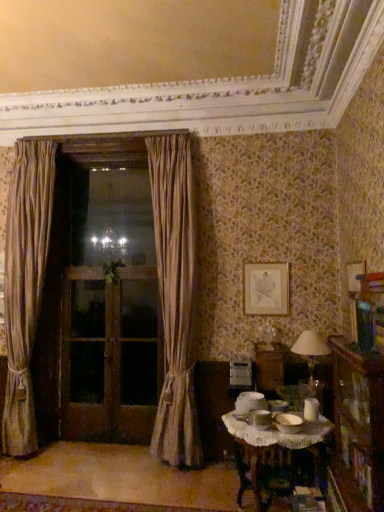
Where is `free space in front of silky beige curtain at center, which appears as the first curtain when viewed from the right`? free space in front of silky beige curtain at center, which appears as the first curtain when viewed from the right is located at coordinates (174, 485).